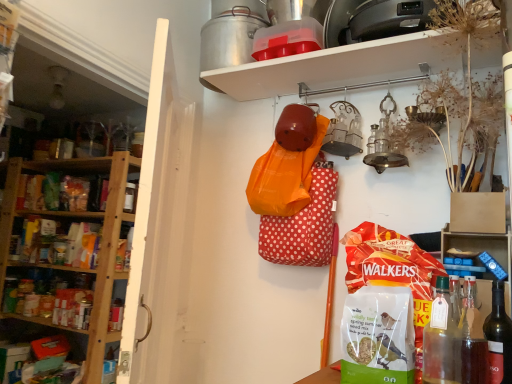
Question: Is white plastic shelf at upper center, which appears as the 1th shelf when viewed from the left, aimed at dark red glass bottle at lower right, the 3th bottle positioned from the left?

Choices:
 (A) yes
 (B) no

Answer: (A)

Question: Does white plastic shelf at upper center, which appears as the 1th shelf when viewed from the left, have a greater height compared to dark red glass bottle at lower right, which is the 1th bottle from right to left?

Choices:
 (A) no
 (B) yes

Answer: (B)

Question: Is white plastic shelf at upper center, which appears as the 1th shelf when viewed from the left, thinner than dark red glass bottle at lower right, which is the 1th bottle from right to left?

Choices:
 (A) no
 (B) yes

Answer: (A)

Question: Is white plastic shelf at upper center, which appears as the 1th shelf when viewed from the left, closer to camera compared to dark red glass bottle at lower right, the 3th bottle positioned from the left?

Choices:
 (A) no
 (B) yes

Answer: (A)

Question: Is white plastic shelf at upper center, which appears as the 1th shelf when viewed from the left, positioned far away from dark red glass bottle at lower right, which is the 1th bottle from right to left?

Choices:
 (A) yes
 (B) no

Answer: (A)

Question: From a real-world perspective, is white plastic shelf at upper center, which is counted as the third shelf, starting from the right, positioned under dark red glass bottle at lower right, which is the 1th bottle from right to left, based on gravity?

Choices:
 (A) no
 (B) yes

Answer: (A)

Question: Is translucent glass bottle at lower right, which appears as the 2th bottle when viewed from the right, positioned far away from blue plastic blocks at right, the third shelf from the left?

Choices:
 (A) yes
 (B) no

Answer: (B)

Question: From a real-world perspective, is translucent glass bottle at lower right, which appears as the 2th bottle when viewed from the right, over blue plastic blocks at right, the third shelf from the left?

Choices:
 (A) no
 (B) yes

Answer: (A)

Question: Is translucent glass bottle at lower right, which appears as the 2th bottle when viewed from the right, in front of blue plastic blocks at right, arranged as the first shelf when viewed from the right?

Choices:
 (A) yes
 (B) no

Answer: (A)

Question: Could you tell me if translucent glass bottle at lower right, which appears as the 2th bottle when viewed from the right, is turned towards blue plastic blocks at right, the third shelf from the left?

Choices:
 (A) no
 (B) yes

Answer: (A)

Question: Is translucent glass bottle at lower right, which appears as the 2th bottle when viewed from the right, surrounding blue plastic blocks at right, the third shelf from the left?

Choices:
 (A) no
 (B) yes

Answer: (A)

Question: Does translucent glass bottle at lower right, which is the 2th bottle from left to right, have a lesser width compared to blue plastic blocks at right, the third shelf from the left?

Choices:
 (A) no
 (B) yes

Answer: (B)

Question: Can you confirm if white plastic shelf at upper center, which appears as the 1th shelf when viewed from the left, is bigger than blue plastic blocks at right, the third shelf from the left?

Choices:
 (A) no
 (B) yes

Answer: (B)